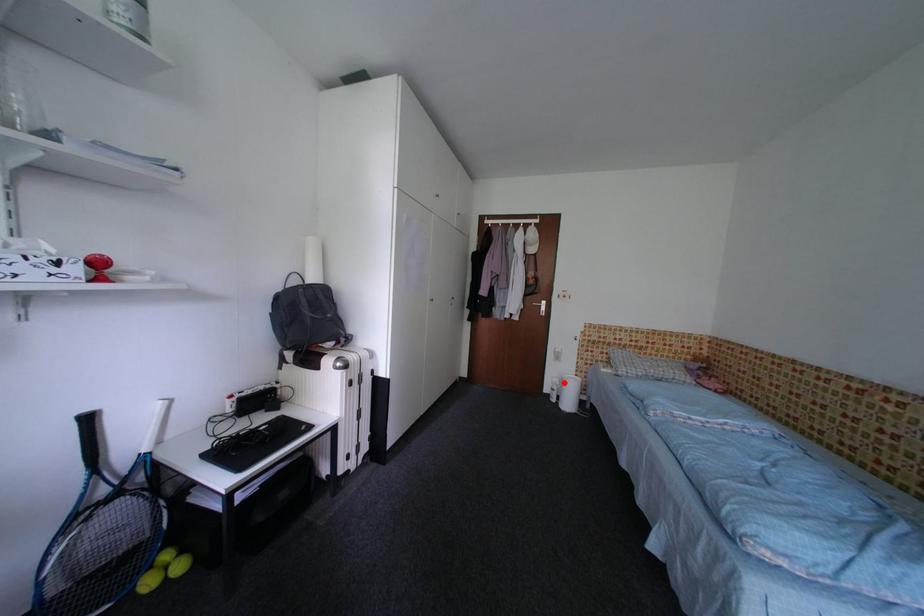
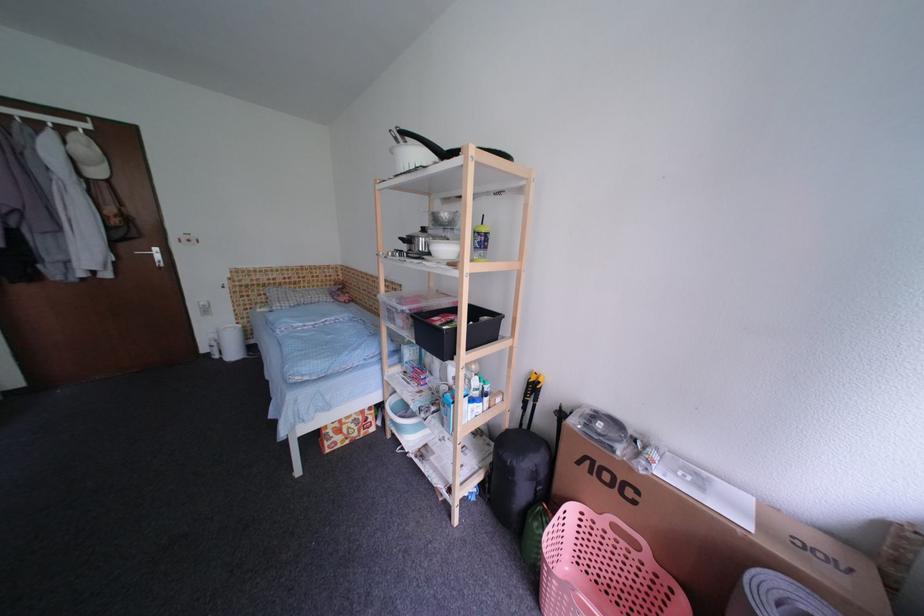
Question: I am providing you with two images of the same scene from different viewpoints. Given a red point in image1, look at the same physical point in image2. Is it:

Choices:
 (A) Closer to the viewpoint
 (B) Farther from the viewpoint

Answer: (A)